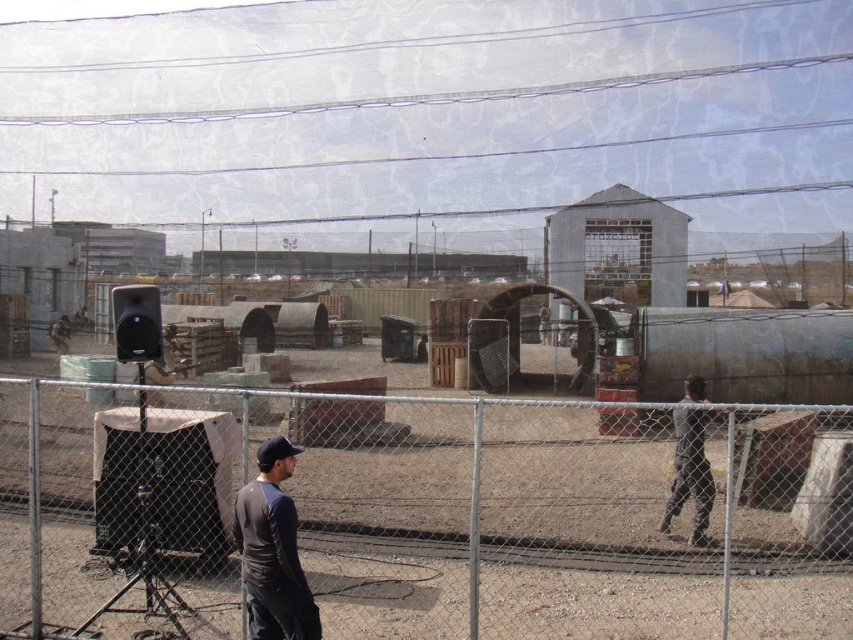
You are a delivery person who needs to hand over a package to the person wearing the dark gray cotton shirt at center and the dark gray fabric jacket at right. Which one should you approach first to ensure you reach them in the shortest time possible?

You should approach the dark gray cotton shirt at center first because it is closer to you than the dark gray fabric jacket at right, so reaching them would take less time.

You are standing at the fence and want to reach the two points inside the construction site. Which point, point (664,544) or point (688,492), is closer to you?

Point (664,544) is closer to you because it is further to the viewer than point (688,492).